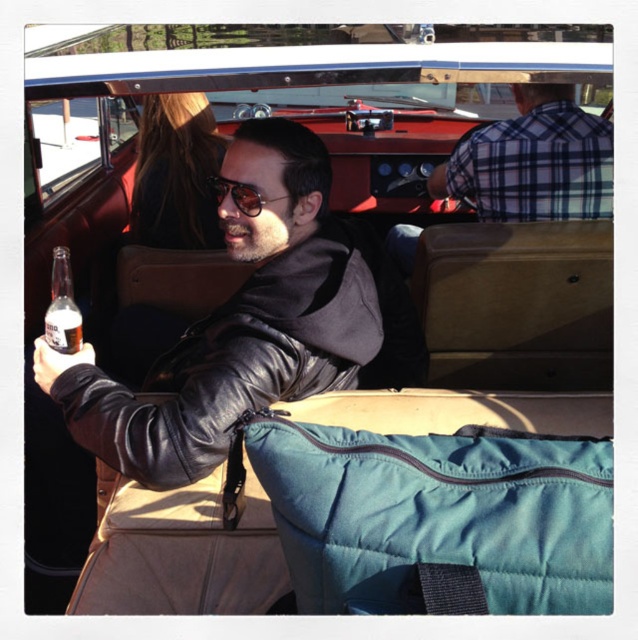
Does leather jacket at center have a smaller size compared to sunglasses at center?

No, leather jacket at center is not smaller than sunglasses at center.

Between leather jacket at center and sunglasses at center, which one is positioned lower?

leather jacket at center is below.

Locate an element on the screen. leather jacket at center is located at coordinates (237, 324).

Where is `clear glass bottle at center`? This screenshot has width=638, height=640. clear glass bottle at center is located at coordinates (63, 326).

The image size is (638, 640). What do you see at coordinates (63, 326) in the screenshot?
I see `clear glass bottle at center` at bounding box center [63, 326].

Find the location of a particular element. clear glass bottle at center is located at coordinates (63, 326).

Does plaid shirt at upper right appear under clear glass bottle at center?

No.

Is point (512, 168) behind point (56, 307)?

That is True.

Between point (544, 106) and point (54, 321), which one is positioned behind?

Positioned behind is point (544, 106).

Identify the location of plaid shirt at upper right. (533, 161).